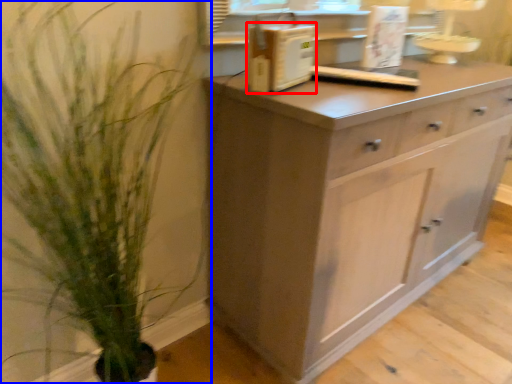
Question: Which object appears farthest to the camera in this image, appliance (highlighted by a red box) or houseplant (highlighted by a blue box)?

Choices:
 (A) appliance
 (B) houseplant

Answer: (A)